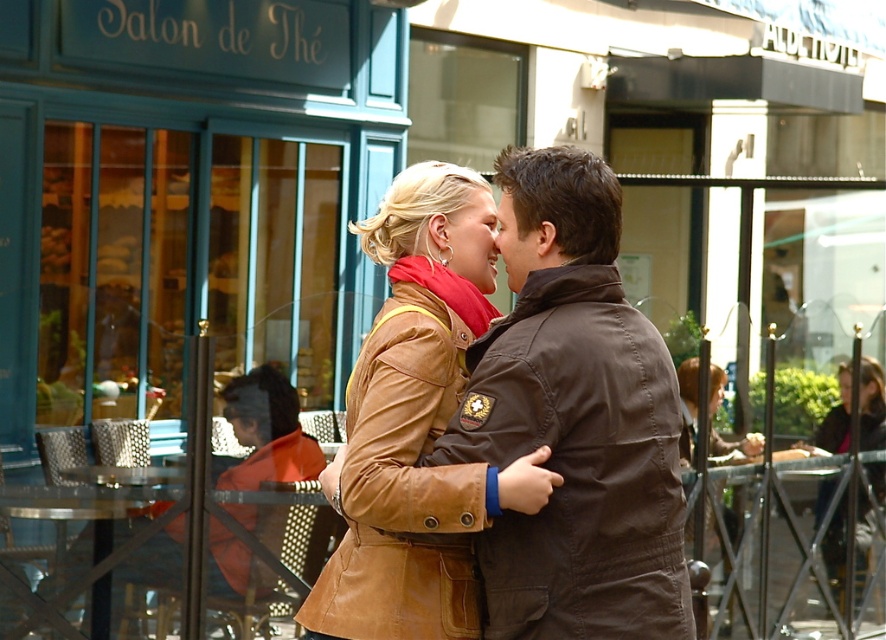
You are a photographer standing at the center of the scene. You want to capture a photo that includes both the orange leather jacket at lower left and the dark brown leather jacket at lower right. What is the minimum distance you need to move backward to ensure both jackets are in frame?

The orange leather jacket at lower left and dark brown leather jacket at lower right are 16.64 feet apart. To include both in the frame, you need to move backward until your camera can capture a field of view that spans at least 16.64 feet between them.